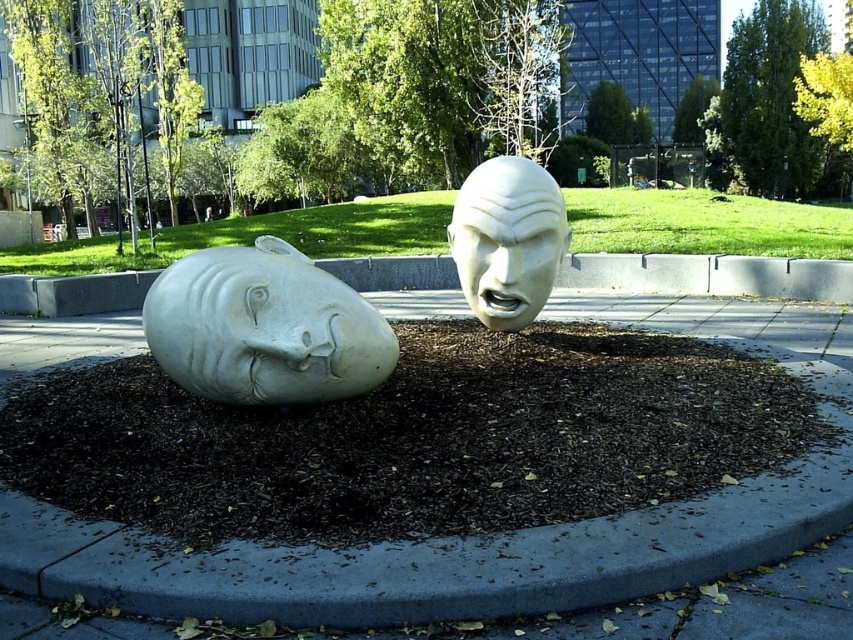
Question: Is white matte sculpture at center to the left of white marble head at left from the viewer's perspective?

Choices:
 (A) no
 (B) yes

Answer: (A)

Question: Which object is the closest to the white matte sculpture at center?

Choices:
 (A) white marble face at center
 (B) white marble head at left

Answer: (B)

Question: Which is farther from the white marble face at center?

Choices:
 (A) white matte sculpture at center
 (B) white marble head at left

Answer: (B)

Question: Does white marble head at left appear under white marble face at center?

Choices:
 (A) no
 (B) yes

Answer: (B)

Question: Observing the image, what is the correct spatial positioning of white marble head at left in reference to white marble face at center?

Choices:
 (A) above
 (B) below

Answer: (B)

Question: Which of the following is the farthest from the observer?

Choices:
 (A) white matte sculpture at center
 (B) white marble face at center

Answer: (B)